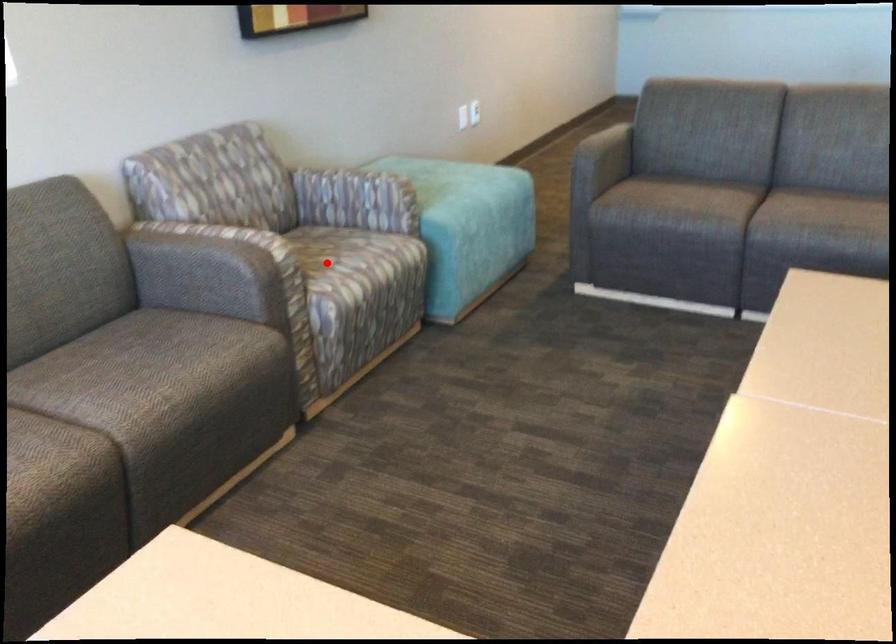
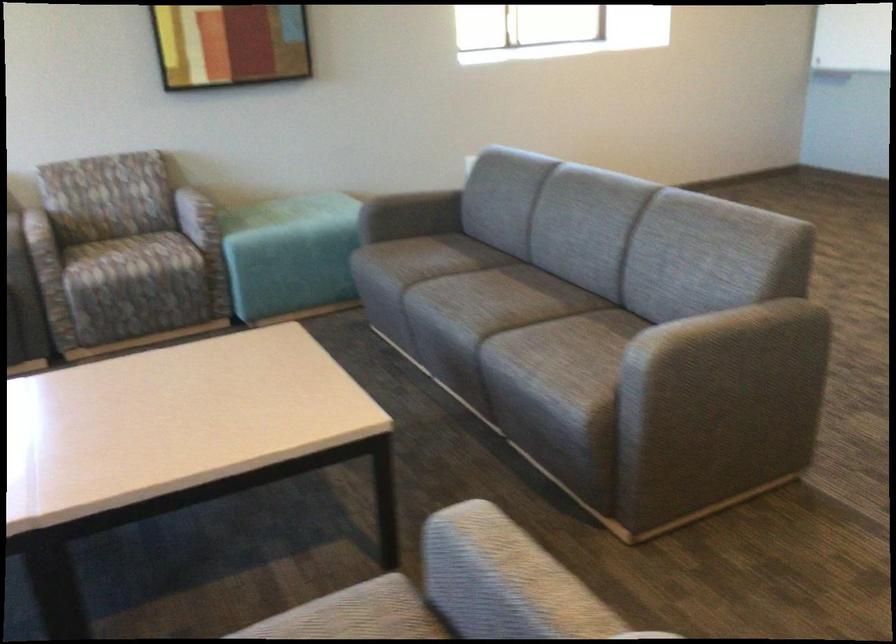
Question: I am providing you with two images of the same scene from different viewpoints. A red point is shown in image1. For the corresponding object point in image2, is it positioned nearer or farther from the camera?

Choices:
 (A) Nearer
 (B) Farther

Answer: (B)